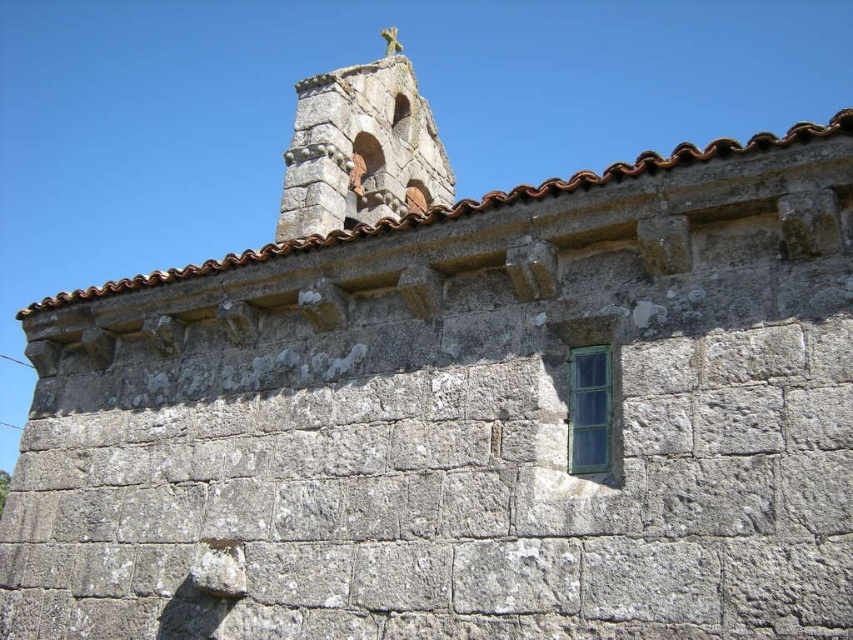
Question: Can you confirm if stone cross at upper center is positioned above green glass window at upper right?

Choices:
 (A) no
 (B) yes

Answer: (B)

Question: Is stone cross at upper center positioned before green glass window at upper right?

Choices:
 (A) no
 (B) yes

Answer: (A)

Question: Which object is closer to the camera taking this photo?

Choices:
 (A) green glass window at upper right
 (B) stone cross at upper center

Answer: (A)

Question: Can you confirm if stone cross at upper center is bigger than green glass window at upper right?

Choices:
 (A) yes
 (B) no

Answer: (A)